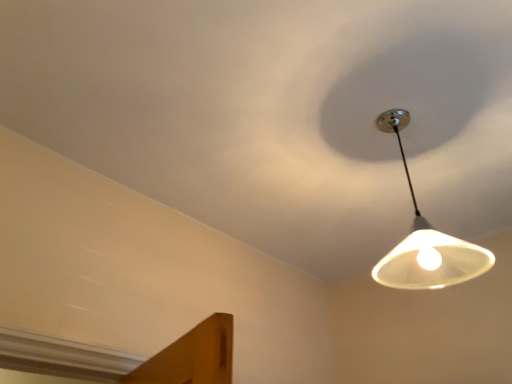
Question: Considering the relative positions of white matte lampshade at upper right and white matte light fixture at upper right in the image provided, is white matte lampshade at upper right to the left or to the right of white matte light fixture at upper right?

Choices:
 (A) right
 (B) left

Answer: (A)

Question: In terms of height, does white matte lampshade at upper right look taller or shorter compared to white matte light fixture at upper right?

Choices:
 (A) short
 (B) tall

Answer: (B)

Question: Looking at their shapes, would you say white matte lampshade at upper right is wider or thinner than white matte light fixture at upper right?

Choices:
 (A) thin
 (B) wide

Answer: (A)

Question: In terms of width, does white matte light fixture at upper right look wider or thinner when compared to white matte lampshade at upper right?

Choices:
 (A) wide
 (B) thin

Answer: (A)

Question: Considering the positions of white matte light fixture at upper right and white matte lampshade at upper right in the image, is white matte light fixture at upper right taller or shorter than white matte lampshade at upper right?

Choices:
 (A) short
 (B) tall

Answer: (A)

Question: Relative to white matte lampshade at upper right, is white matte light fixture at upper right in front or behind?

Choices:
 (A) front
 (B) behind

Answer: (A)

Question: Is white matte light fixture at upper right bigger or smaller than white matte lampshade at upper right?

Choices:
 (A) big
 (B) small

Answer: (A)